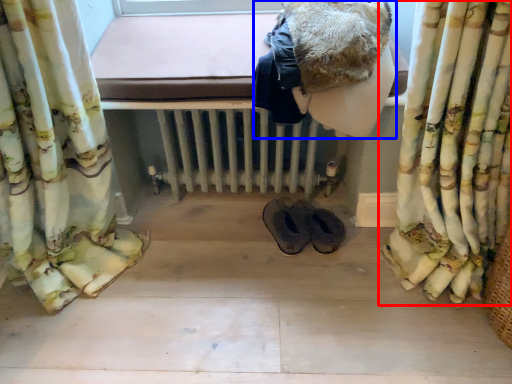
Question: Which object appears closest to the camera in this image, curtain (highlighted by a red box) or clothing (highlighted by a blue box)?

Choices:
 (A) curtain
 (B) clothing

Answer: (A)